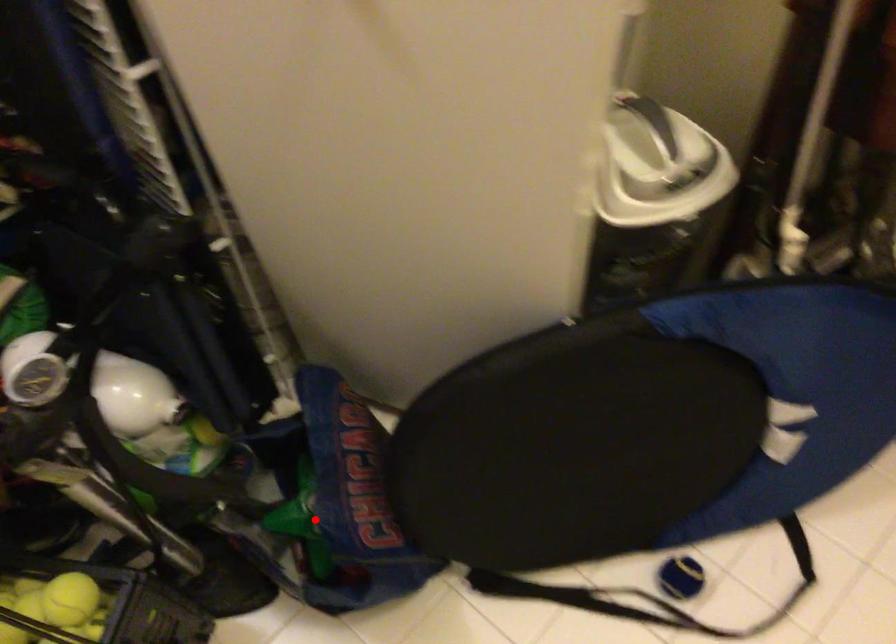
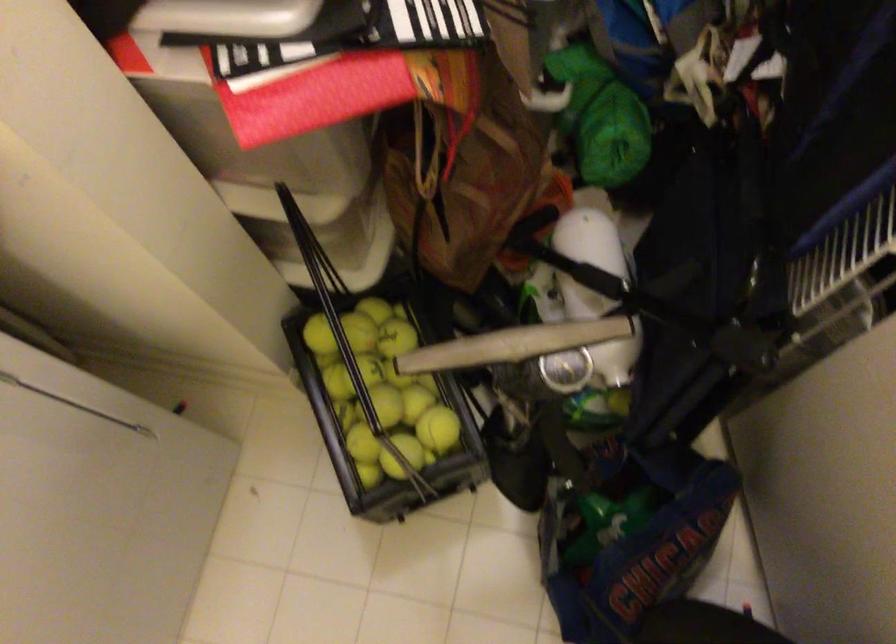
Question: I am providing you with two images of the same scene from different viewpoints. A red point is marked on the first image. Is the red point's position out of view in image 2?

Choices:
 (A) Yes
 (B) No

Answer: (B)